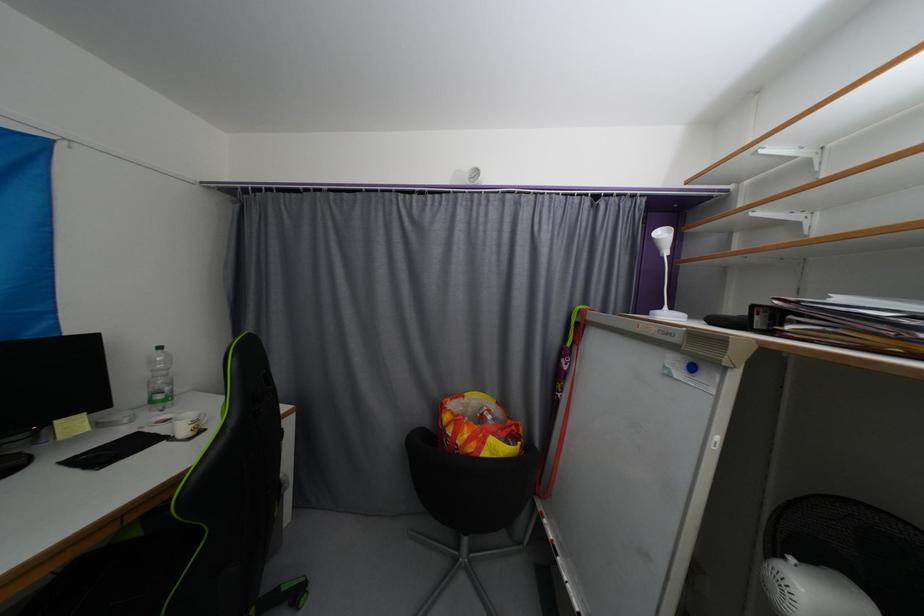
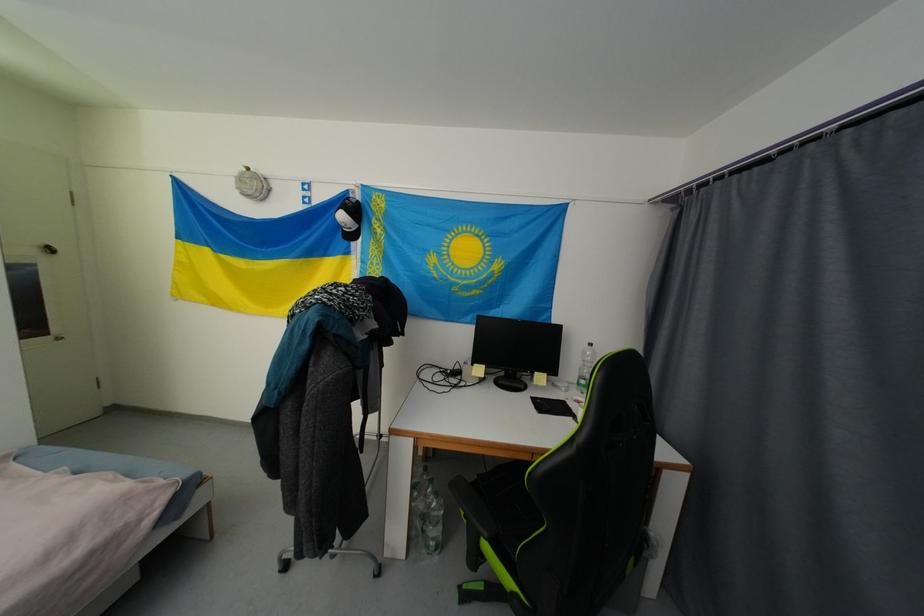
In the second image, find the point that corresponds to the point at 157,403 in the first image.

(584, 386)